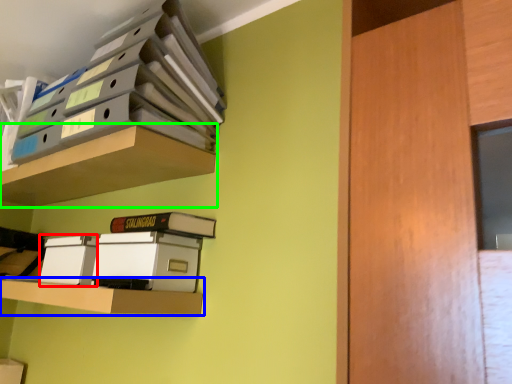
Question: Estimate the real-world distances between objects in this image. Which object is closer to storage box (highlighted by a red box), shelf (highlighted by a blue box) or shelf (highlighted by a green box)?

Choices:
 (A) shelf
 (B) shelf

Answer: (A)